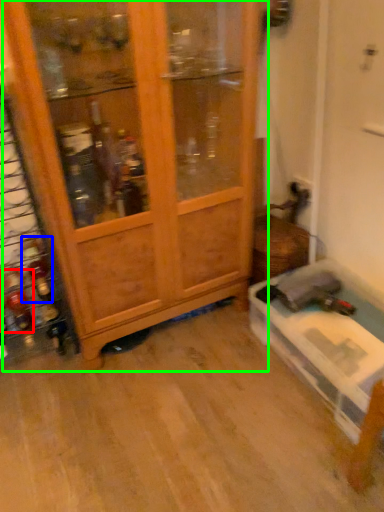
Question: Considering the real-world distances, which object is farthest from bottle (highlighted by a red box)? bottle (highlighted by a blue box) or cupboard (highlighted by a green box)?

Choices:
 (A) bottle
 (B) cupboard

Answer: (B)